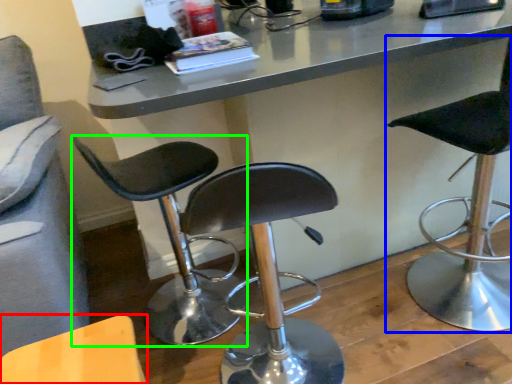
Question: Estimate the real-world distances between objects in this image. Which object is closer to chair (highlighted by a red box), chair (highlighted by a blue box) or chair (highlighted by a green box)?

Choices:
 (A) chair
 (B) chair

Answer: (B)